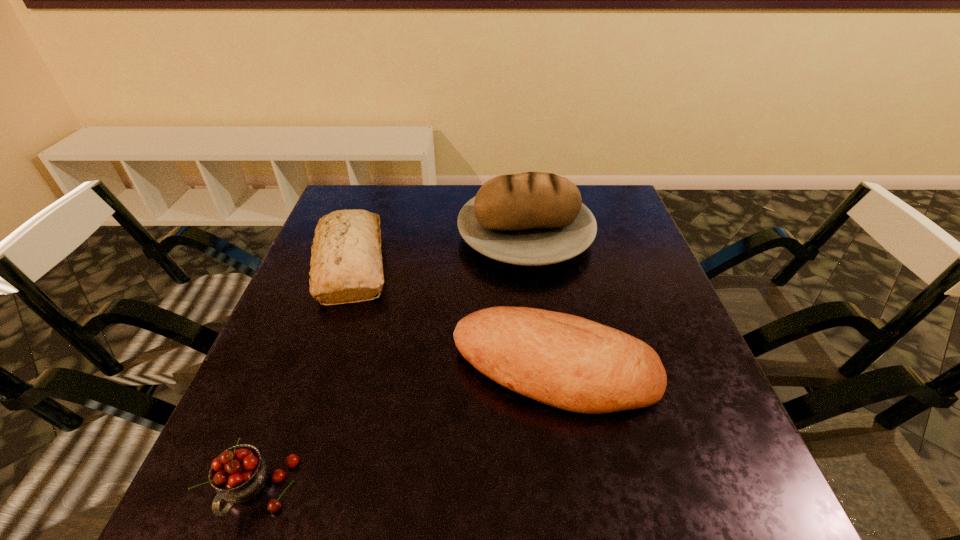
Point out which bread is positioned as the nearest to the third farthest object. Please provide its 2D coordinates. Your answer should be formatted as a tuple, i.e. [(x, y)], where the tuple contains the x and y coordinates of a point satisfying the conditions above.

[(533, 218)]

Locate an element on the screen. free space that satisfies the following two spatial constraints: 1. on the back side of the tallest bread; 2. on the right side of the leftmost bread is located at coordinates (362, 235).